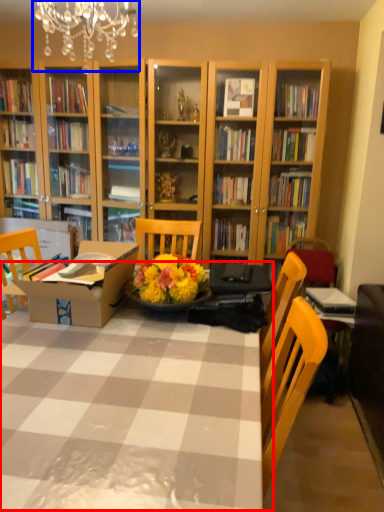
Question: Which object appears farthest to the camera in this image, table (highlighted by a red box) or light fixture (highlighted by a blue box)?

Choices:
 (A) table
 (B) light fixture

Answer: (B)